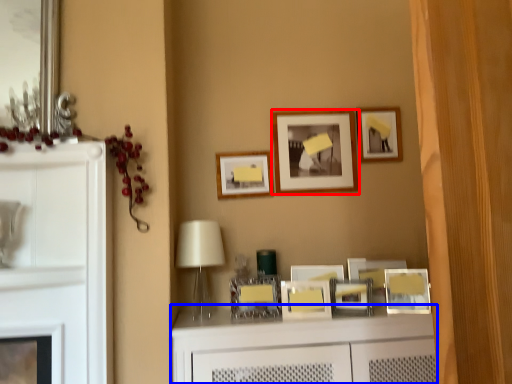
Question: Which object is closer to the camera taking this photo, picture frame (highlighted by a red box) or vanity (highlighted by a blue box)?

Choices:
 (A) picture frame
 (B) vanity

Answer: (B)